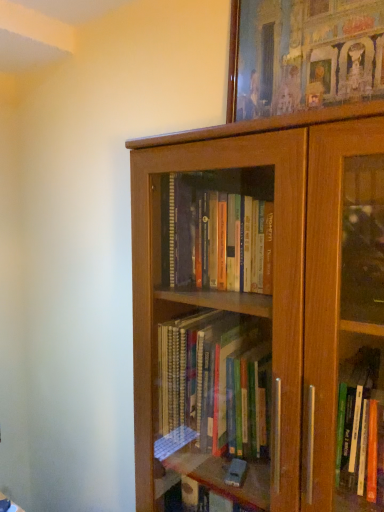
Question: Is brown wood bookcase at center further to camera compared to wooden picture frame at upper center?

Choices:
 (A) yes
 (B) no

Answer: (B)

Question: Considering the relative sizes of brown wood bookcase at center and wooden picture frame at upper center in the image provided, is brown wood bookcase at center smaller than wooden picture frame at upper center?

Choices:
 (A) no
 (B) yes

Answer: (A)

Question: Is brown wood bookcase at center oriented away from wooden picture frame at upper center?

Choices:
 (A) no
 (B) yes

Answer: (A)

Question: Is brown wood bookcase at center wider than wooden picture frame at upper center?

Choices:
 (A) yes
 (B) no

Answer: (A)

Question: From the image's perspective, is brown wood bookcase at center located above wooden picture frame at upper center?

Choices:
 (A) yes
 (B) no

Answer: (B)

Question: Considering the relative positions of brown wood bookcase at center and wooden picture frame at upper center in the image provided, is brown wood bookcase at center to the right of wooden picture frame at upper center from the viewer's perspective?

Choices:
 (A) no
 (B) yes

Answer: (A)

Question: Does wooden picture frame at upper center have a lesser width compared to brown wood bookcase at center?

Choices:
 (A) yes
 (B) no

Answer: (A)

Question: Does wooden picture frame at upper center have a larger size compared to brown wood bookcase at center?

Choices:
 (A) yes
 (B) no

Answer: (B)

Question: From a real-world perspective, is wooden picture frame at upper center over brown wood bookcase at center?

Choices:
 (A) no
 (B) yes

Answer: (B)

Question: Is wooden picture frame at upper center surrounding brown wood bookcase at center?

Choices:
 (A) no
 (B) yes

Answer: (A)

Question: Is wooden picture frame at upper center not near brown wood bookcase at center?

Choices:
 (A) no
 (B) yes

Answer: (A)

Question: Is wooden picture frame at upper center located outside brown wood bookcase at center?

Choices:
 (A) yes
 (B) no

Answer: (A)

Question: From a real-world perspective, relative to wooden picture frame at upper center, is brown wood bookcase at center vertically above or below?

Choices:
 (A) above
 (B) below

Answer: (B)